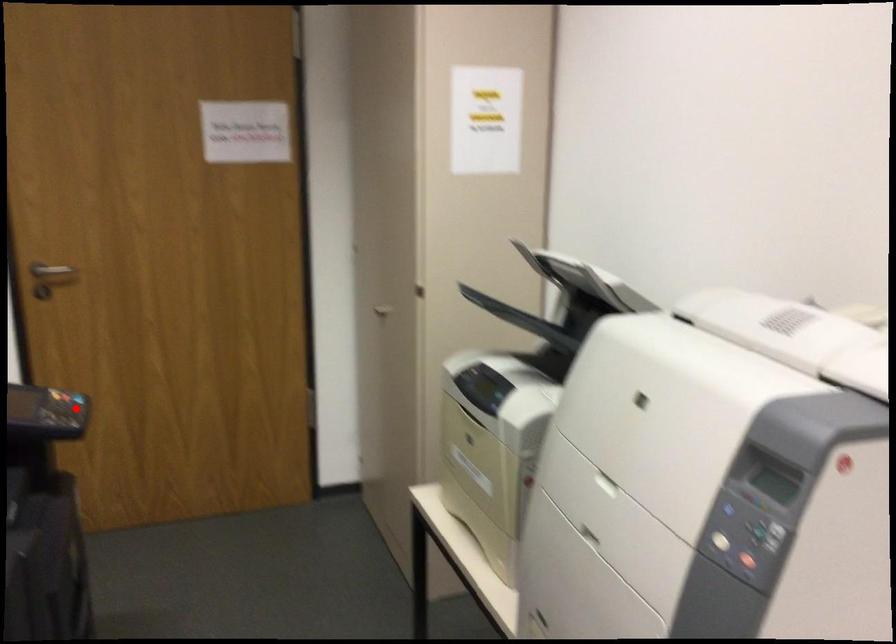
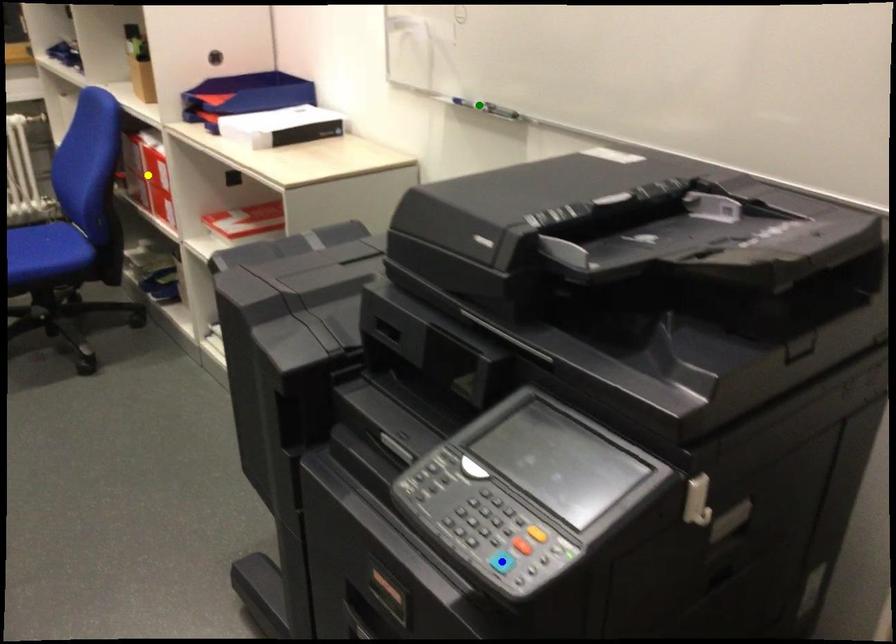
Question: I am providing you with two images of the same scene from different viewpoints. A red point is marked on the first image. You are given multiple points on the second image. Which mark in image 2 goes with the point in image 1?

Choices:
 (A) yellow point
 (B) blue point
 (C) green point

Answer: (B)